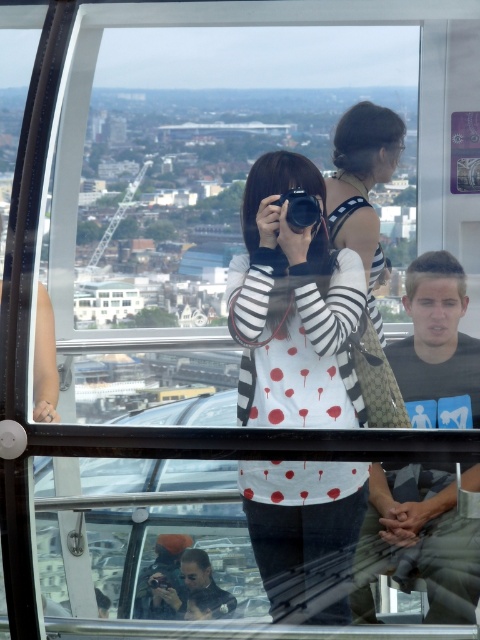
Is black matte shirt at center bigger than black plastic camera at center?

Yes, black matte shirt at center is bigger than black plastic camera at center.

What do you see at coordinates (436, 346) in the screenshot?
I see `black matte shirt at center` at bounding box center [436, 346].

In order to click on black matte shirt at center in this screenshot , I will do tap(436, 346).

Can you confirm if white striped shirt at center is positioned to the right of black plastic camera at center?

Yes, white striped shirt at center is to the right of black plastic camera at center.

Locate an element on the screen. This screenshot has width=480, height=640. white striped shirt at center is located at coordinates (292, 308).

The height and width of the screenshot is (640, 480). In order to click on white striped shirt at center in this screenshot , I will do [292, 308].

In order to click on white striped shirt at center in this screenshot , I will do `click(292, 308)`.

Consider the image. Between white striped shirt at center and black matte shirt at center, which one is positioned lower?

Positioned lower is white striped shirt at center.

This screenshot has width=480, height=640. In order to click on white striped shirt at center in this screenshot , I will do `click(292, 308)`.

Who is more forward, (255, 371) or (439, 534)?

Point (255, 371)

The height and width of the screenshot is (640, 480). I want to click on white striped shirt at center, so click(292, 308).